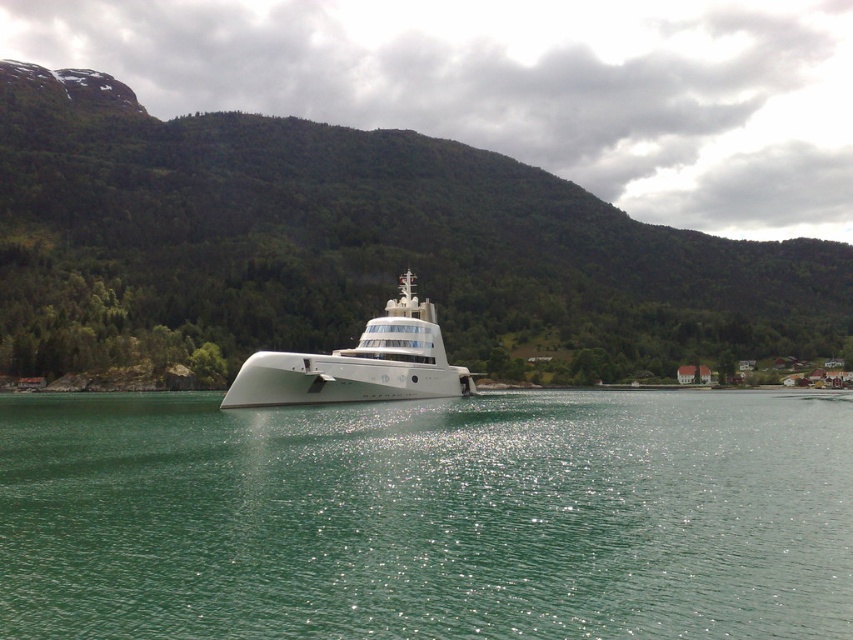
You are a passenger on the white glossy cruise ship at center. You want to jump into the water. Which direction should you go to reach the green glossy water at center?

The green glossy water at center is positioned under the white glossy cruise ship at center, so you can jump straight down from the white glossy cruise ship at center to reach the green glossy water at center.

You are a sailor on a small boat approaching the white glossy cruise ship at center. You notice the green glossy water at center between your boat and the cruise ship. Can your boat, which is 15 meters long, safely navigate through the space between your current position and the cruise ship without hitting it?

The green glossy water at center is 14.21 meters from the white glossy cruise ship at center. Since your boat is 15 meters long, it is longer than the available space. Therefore, your boat cannot safely navigate through the space without hitting the cruise ship.